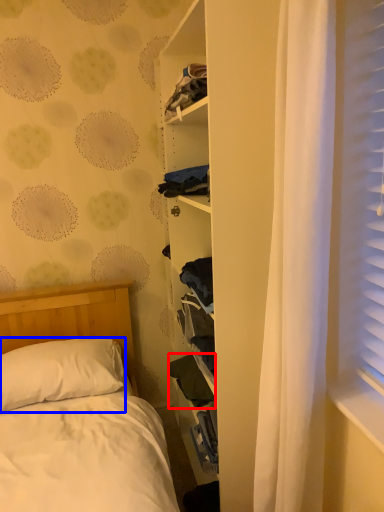
Question: Which point is further to the camera, clothing (highlighted by a red box) or pillow (highlighted by a blue box)?

Choices:
 (A) clothing
 (B) pillow

Answer: (A)